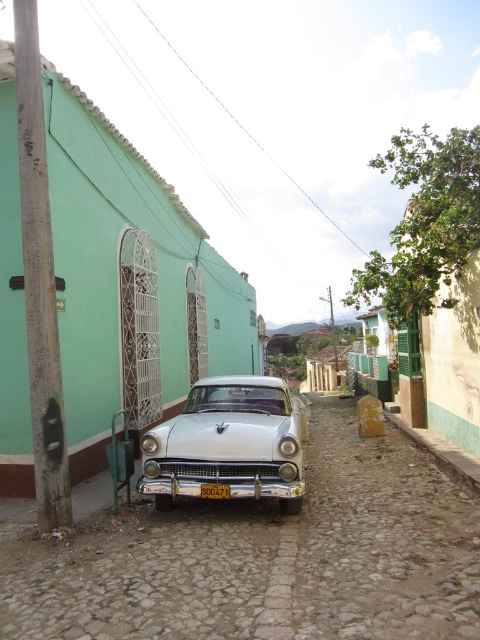
Is white glossy car at center shorter than yellow matte license plate at center?

No, white glossy car at center is not shorter than yellow matte license plate at center.

Does point (266, 435) come farther from viewer compared to point (218, 490)?

That is True.

Find the location of a particular element. white glossy car at center is located at coordinates (228, 444).

Can you confirm if metallic silver car at center is wider than yellow matte license plate at center?

Indeed, metallic silver car at center has a greater width compared to yellow matte license plate at center.

Describe the element at coordinates (266, 557) in the screenshot. The width and height of the screenshot is (480, 640). I see `metallic silver car at center` at that location.

Image resolution: width=480 pixels, height=640 pixels. What are the coordinates of `metallic silver car at center` in the screenshot? It's located at (266, 557).

The height and width of the screenshot is (640, 480). I want to click on metallic silver car at center, so click(x=266, y=557).

Between metallic silver car at center and white glossy car at center, which one is positioned higher?

white glossy car at center

Is point (358, 506) positioned behind point (208, 416)?

No, it is not.

The image size is (480, 640). Describe the element at coordinates (266, 557) in the screenshot. I see `metallic silver car at center` at that location.

This screenshot has width=480, height=640. Identify the location of metallic silver car at center. (266, 557).